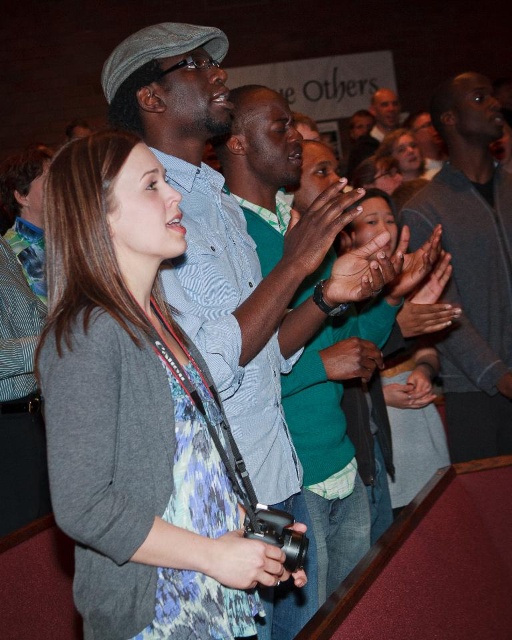
You are standing at the point marked as point [269,573] in the image, which is 4.16 feet away from you. You want to take a photo of the woman with the camera around her neck. Is the distance sufficient to capture her clearly in the photo?

The distance of point [269,573] from the viewer is 4.16 feet. This distance should be sufficient to capture the woman with the camera around her neck clearly in the photo.

You are standing at the front of the church and want to hand a gift to the person wearing the gray sweater at upper right. The gift is 2 meters long. Can you reach them without moving? Explain your reasoning.

The distance between you and the person wearing the gray sweater at upper right is 2.61 meters. Since the gift is 2 meters long, you can extend it to reach them as the distance is greater than the gift length, so you can hand it over without moving.

You are standing at the entrance of the church and see the point marked at coordinates (243,561). What object is located there?

The object at point (243,561) is a matte black camera at center.